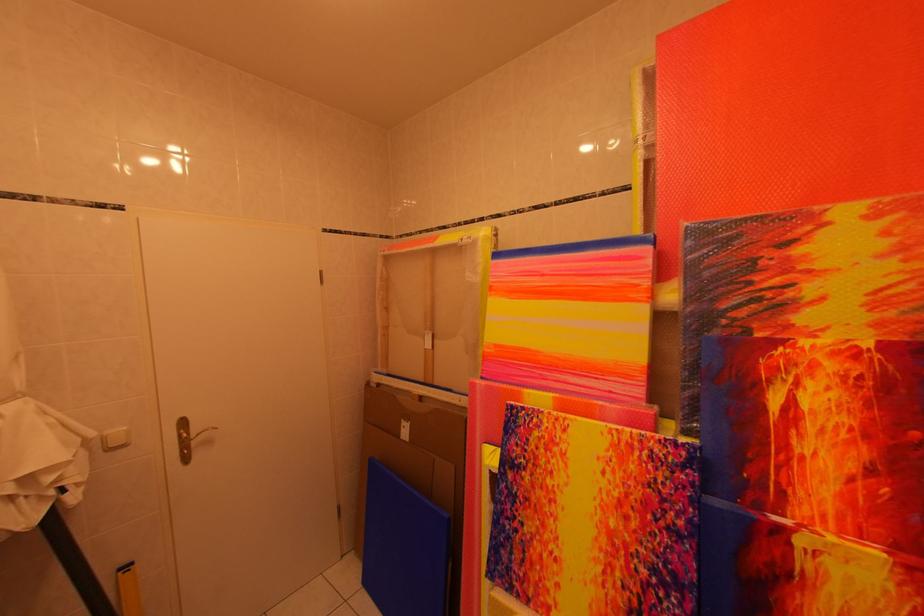
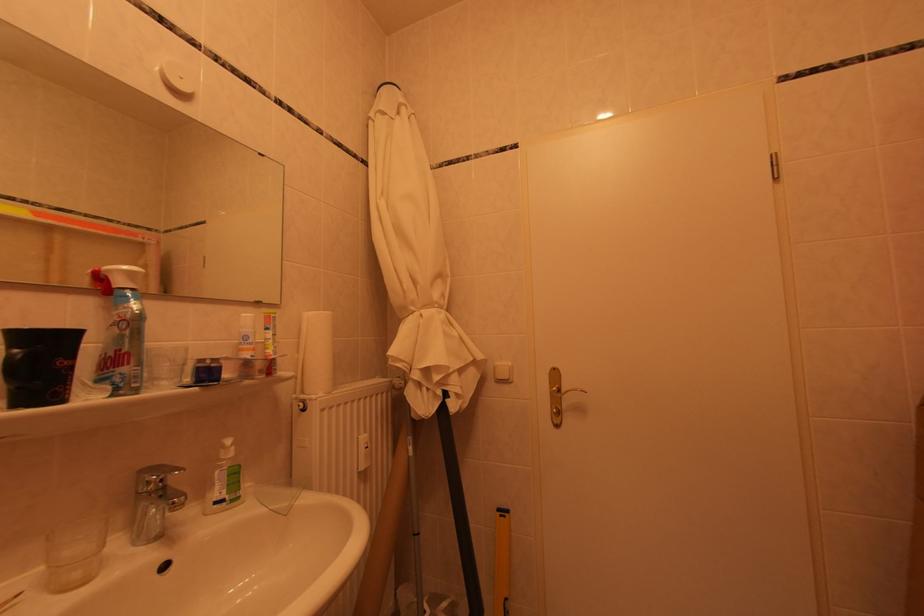
In the second image, find the point that corresponds to the point at 132,578 in the first image.

(509, 519)